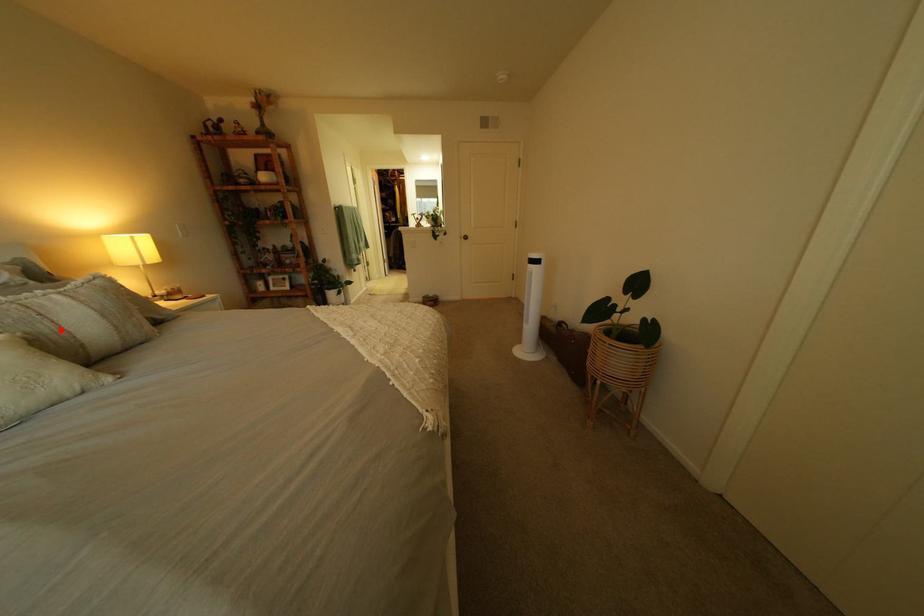
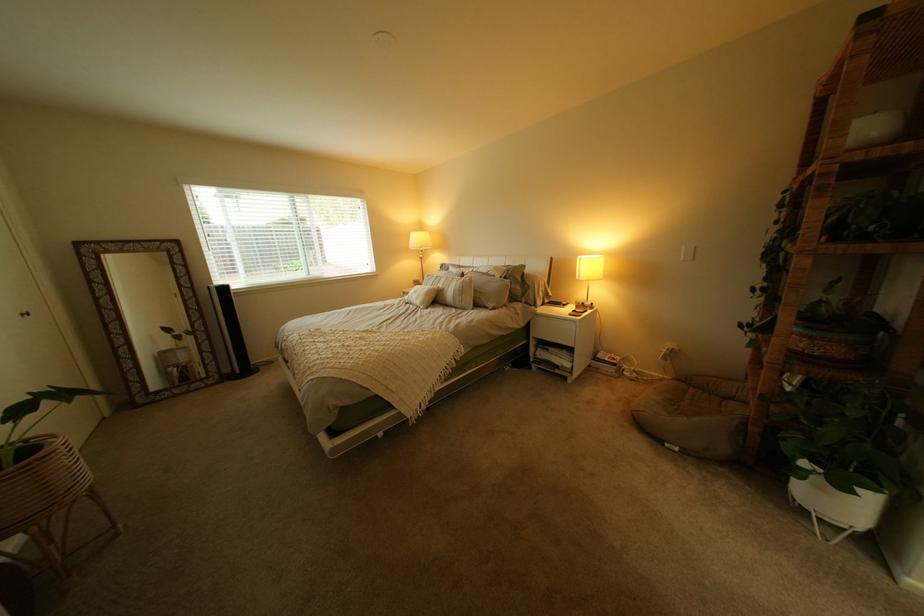
In the second image, find the point that corresponds to the highlighted location in the first image.

(462, 290)